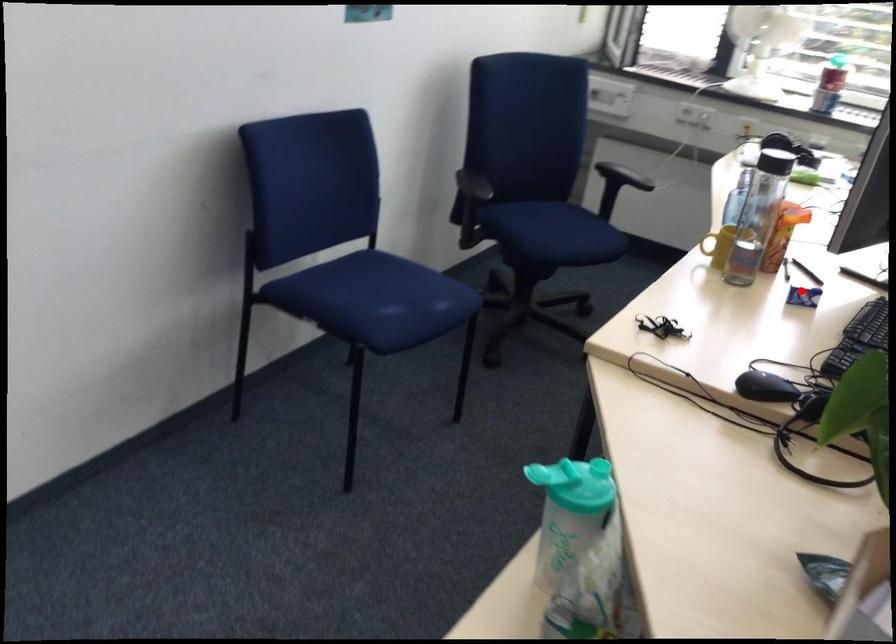
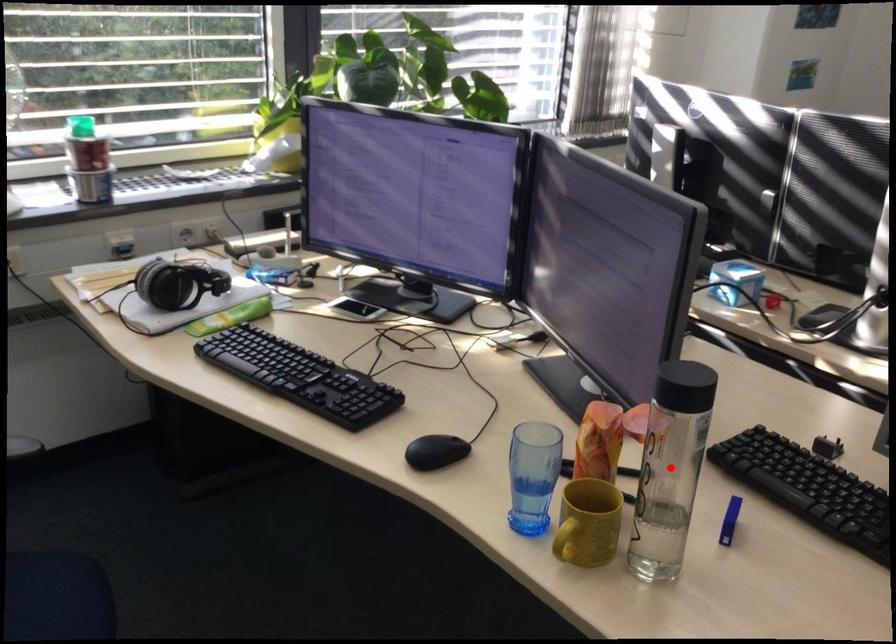
Consider the image. I am providing you with two images of the same scene from different viewpoints. A red point is marked on the first image and another point is marked on the second image. Is the red point in image1 aligned with the point shown in image2?

No